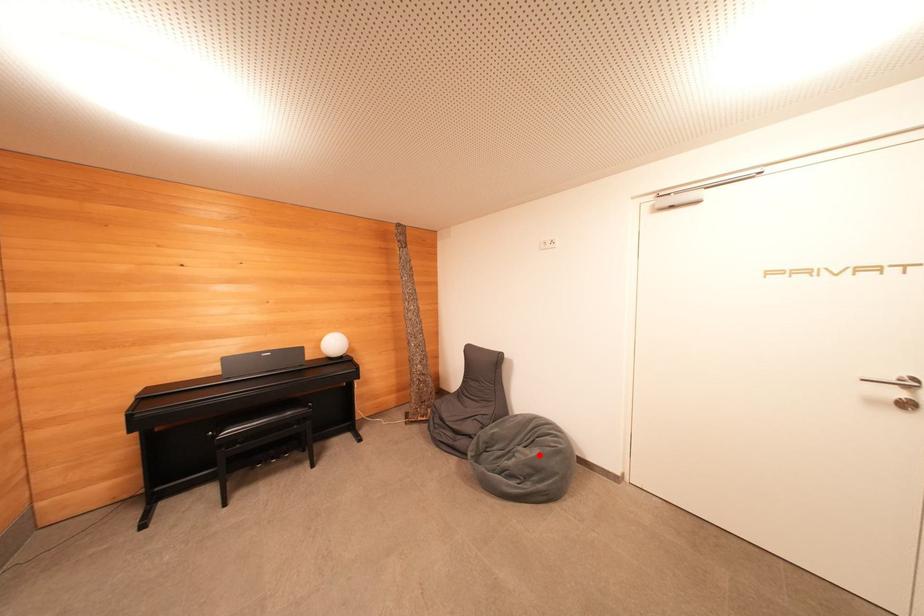
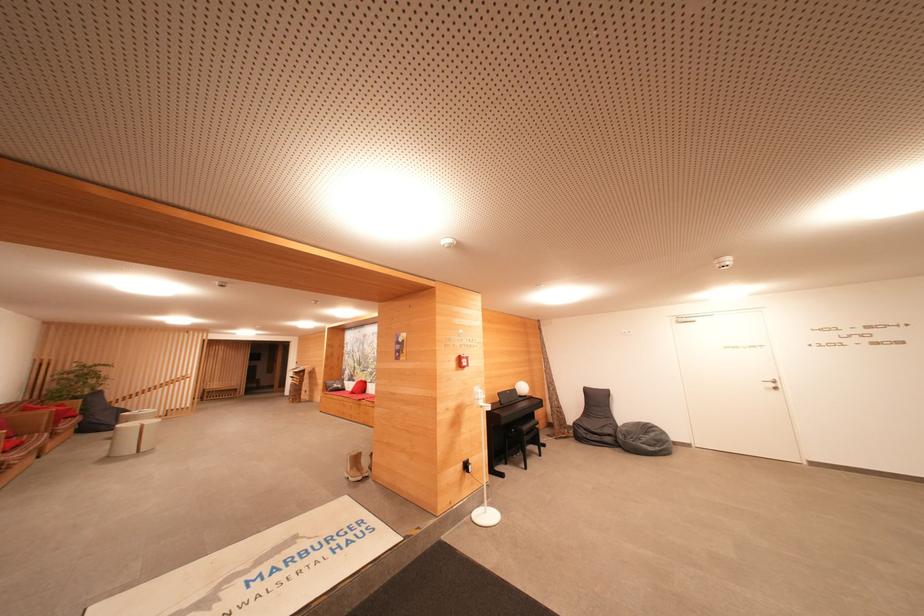
Question: I am providing you with two images of the same scene from different viewpoints. Image1 has a red point marked. In image2, the corresponding 3D location appears at what relative position? Reply with the corresponding letter.

Choices:
 (A) Closer
 (B) Farther

Answer: (B)